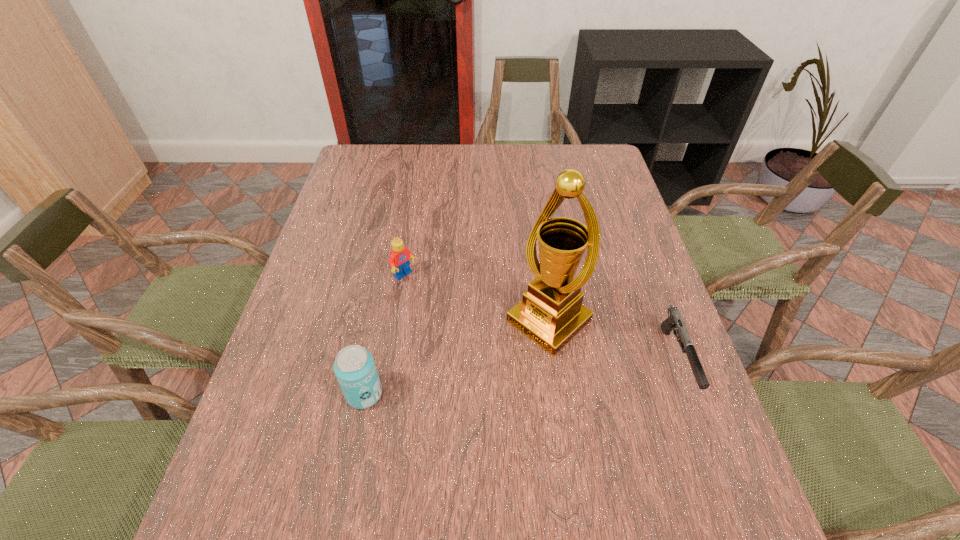
This screenshot has width=960, height=540. Find the location of `beer can`. beer can is located at coordinates (354, 366).

At what (x,y) coordinates should I click in order to perform the action: click on gun. Please return your answer as a coordinate pair (x, y). This screenshot has height=540, width=960. Looking at the image, I should click on (674, 322).

This screenshot has width=960, height=540. In order to click on the rightmost object in this screenshot , I will do click(674, 322).

Locate an element on the screen. The width and height of the screenshot is (960, 540). award is located at coordinates (551, 313).

Locate an element on the screen. This screenshot has width=960, height=540. the third object from left to right is located at coordinates (551, 313).

Image resolution: width=960 pixels, height=540 pixels. In order to click on the farthest object in this screenshot , I will do `click(400, 256)`.

You are a GUI agent. You are given a task and a screenshot of the screen. Output one action in this format:
    pyautogui.click(x=<x>, y=<y>)
    Task: Click on the free space located on the back of the beer can
    This screenshot has height=540, width=960.
    Given the screenshot: What is the action you would take?
    pyautogui.click(x=378, y=323)

Find the location of a particular element. free spot located 0.100m at the muzzle end of the shortest object is located at coordinates (710, 453).

Locate an element on the screen. free space located on the front-facing side of the third object from left to right is located at coordinates (386, 464).

Locate an element on the screen. This screenshot has height=540, width=960. free space located 0.100m on the front-facing side of the third object from left to right is located at coordinates (491, 373).